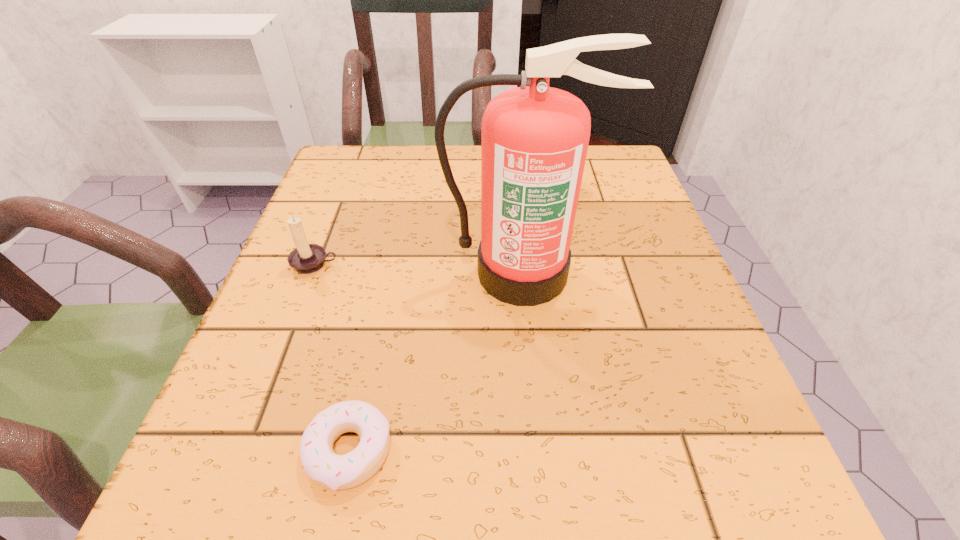
What are the coordinates of `free space that is in between the fire extinguisher and the candle holder` in the screenshot? It's located at (420, 269).

Locate an element on the screen. This screenshot has height=540, width=960. empty location between the candle holder and the shortest object is located at coordinates (332, 357).

You are a GUI agent. You are given a task and a screenshot of the screen. Output one action in this format:
    pyautogui.click(x=<x>, y=<y>)
    Task: Click on the free spot between the candle holder and the shortest object
    The width and height of the screenshot is (960, 540).
    Given the screenshot: What is the action you would take?
    pyautogui.click(x=332, y=357)

Identify the location of free space between the nearest object and the fire extinguisher. The width and height of the screenshot is (960, 540). (436, 362).

What are the coordinates of `vacant area between the candle holder and the nearest object` in the screenshot? It's located at (332, 357).

Select which object appears as the closest to the nearest object. Please provide its 2D coordinates. Your answer should be formatted as a tuple, i.e. [(x, y)], where the tuple contains the x and y coordinates of a point satisfying the conditions above.

[(534, 139)]

Choose which object is the second nearest neighbor to the doughnut. Please provide its 2D coordinates. Your answer should be formatted as a tuple, i.e. [(x, y)], where the tuple contains the x and y coordinates of a point satisfying the conditions above.

[(306, 258)]